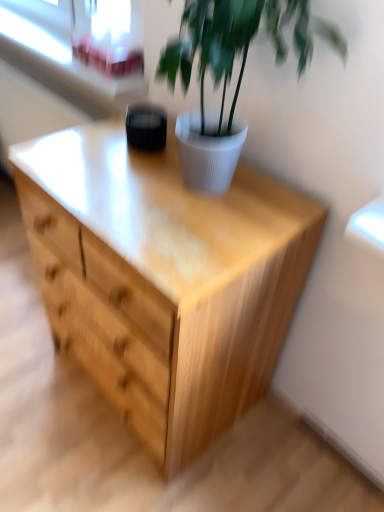
Question: From a real-world perspective, is white ribbed pot at upper center on white plastic window frame at upper left?

Choices:
 (A) no
 (B) yes

Answer: (B)

Question: Is white ribbed pot at upper center turned away from white plastic window frame at upper left?

Choices:
 (A) yes
 (B) no

Answer: (B)

Question: Is white ribbed pot at upper center to the left of white plastic window frame at upper left from the viewer's perspective?

Choices:
 (A) yes
 (B) no

Answer: (B)

Question: Does white ribbed pot at upper center have a greater height compared to white plastic window frame at upper left?

Choices:
 (A) no
 (B) yes

Answer: (B)

Question: Does white ribbed pot at upper center come in front of white plastic window frame at upper left?

Choices:
 (A) yes
 (B) no

Answer: (A)

Question: Considering the relative sizes of white ribbed pot at upper center and white plastic window frame at upper left in the image provided, is white ribbed pot at upper center thinner than white plastic window frame at upper left?

Choices:
 (A) no
 (B) yes

Answer: (A)

Question: Is white ribbed pot at upper center bigger than natural wood chest of drawers at center?

Choices:
 (A) no
 (B) yes

Answer: (A)

Question: Does white ribbed pot at upper center lie behind natural wood chest of drawers at center?

Choices:
 (A) no
 (B) yes

Answer: (A)

Question: Can you confirm if white ribbed pot at upper center is smaller than natural wood chest of drawers at center?

Choices:
 (A) no
 (B) yes

Answer: (B)

Question: Can you confirm if white ribbed pot at upper center is taller than natural wood chest of drawers at center?

Choices:
 (A) no
 (B) yes

Answer: (A)

Question: From a real-world perspective, is white ribbed pot at upper center positioned under natural wood chest of drawers at center based on gravity?

Choices:
 (A) yes
 (B) no

Answer: (B)

Question: From the image's perspective, would you say white ribbed pot at upper center is shown under natural wood chest of drawers at center?

Choices:
 (A) yes
 (B) no

Answer: (B)

Question: Does natural wood chest of drawers at center have a lesser width compared to transparent glass window screen at upper left?

Choices:
 (A) no
 (B) yes

Answer: (A)